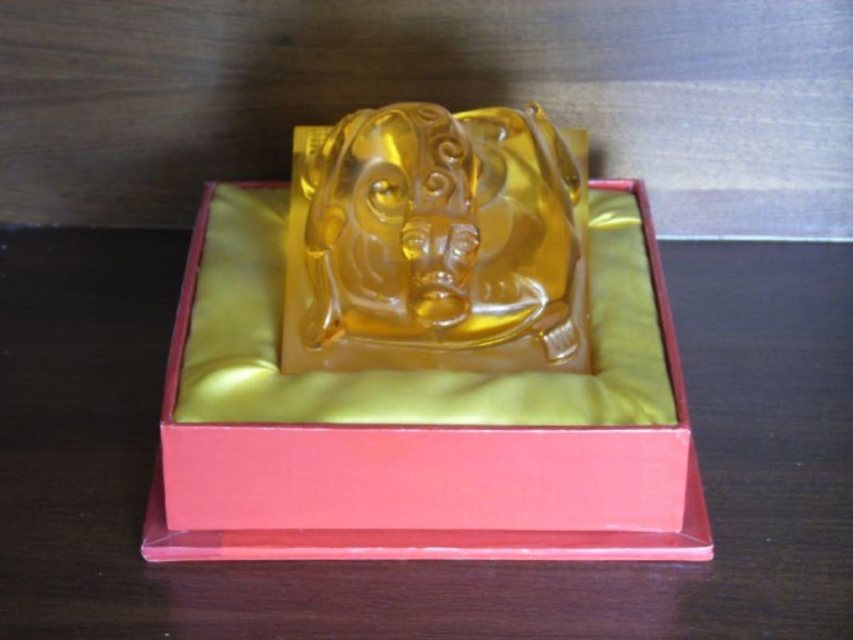
Consider the image. What are the coordinates of the translucent amber statue at center?

The coordinates of the translucent amber statue at center are point (424,474).

You have a small package that needs to be shipped. The shipping box you have can only accommodate items up to 7 inches in length. You see the translucent amber statue at center and the translucent amber sculpture at center in the image. Can both items fit side by side within the shipping box without overlapping?

The translucent amber statue at center and the translucent amber sculpture at center are 7.22 inches apart, which exceeds the 7 inches limit of the shipping box. Therefore, they cannot fit side by side without overlapping.

You are a delivery person who needs to pack the translucent amber statue at center and the translucent amber sculpture at center into a box that can only hold items with a combined width of 50 cm. If the statue is wider than the sculpture, what is the maximum possible width each item can have without exceeding the limit?

The translucent amber statue at center is wider than the translucent amber sculpture at center. To maximize the width of each item without exceeding the 50 cm limit, the statue can be up to 25 cm and the sculpture up to 25 cm, but since the statue is wider, it must be more than the sculpture. For example, the statue could be 30 cm and the sculpture 20 cm, totaling 50 cm.